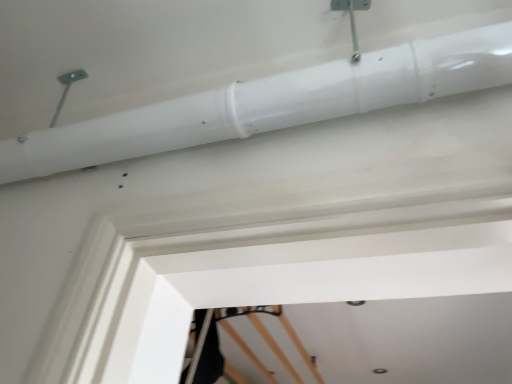
Looking at this image, in order to face white plastic pipe at upper center, should I rotate leftwards or rightwards?

To face it directly, rotate left by 12.508 degrees.

This screenshot has height=384, width=512. Describe the element at coordinates (272, 103) in the screenshot. I see `white plastic pipe at upper center` at that location.

What is the approximate height of white plastic pipe at upper center?

The height of white plastic pipe at upper center is 16.75 centimeters.

The image size is (512, 384). Identify the location of white plastic pipe at upper center. (272, 103).

In order to click on white plastic pipe at upper center in this screenshot , I will do `click(272, 103)`.